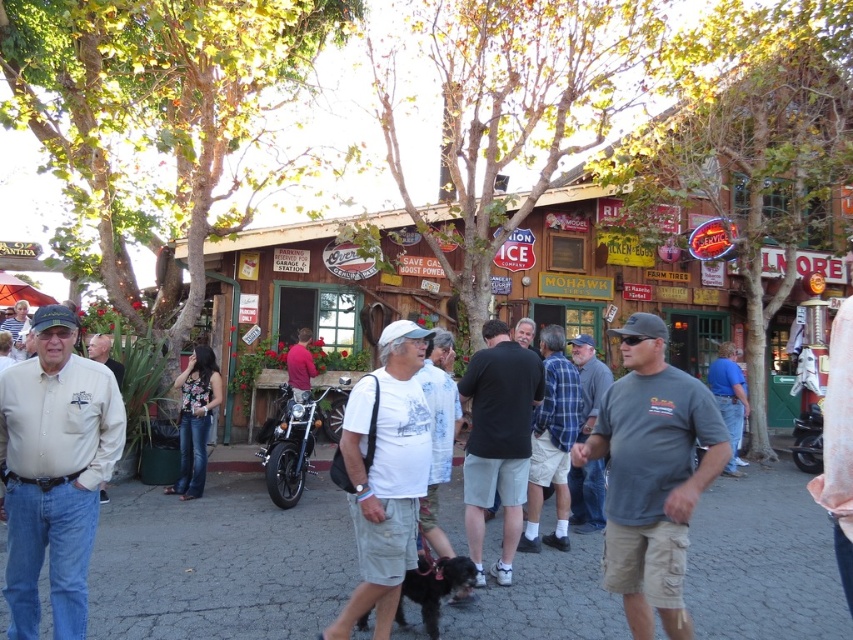
Question: Observing the image, what is the correct spatial positioning of light beige shirt at center in reference to white cotton t-shirt at center?

Choices:
 (A) above
 (B) below

Answer: (A)

Question: Estimate the real-world distances between objects in this image. Which object is closer to the light beige shirt at center?

Choices:
 (A) white cotton t-shirt at center
 (B) gray cotton t-shirt at center
 (C) gray cotton shirt at center
 (D) black cotton t-shirt at center

Answer: (A)

Question: Which of the following is the closest to the observer?

Choices:
 (A) gray cotton t-shirt at center
 (B) light beige shirt at center

Answer: (A)

Question: Does light beige shirt at center appear on the right side of white cotton t-shirt at center?

Choices:
 (A) no
 (B) yes

Answer: (A)

Question: Is light beige shirt at center further to camera compared to gray cotton t-shirt at center?

Choices:
 (A) no
 (B) yes

Answer: (B)

Question: Estimate the real-world distances between objects in this image. Which object is closer to the white cotton t-shirt at center?

Choices:
 (A) black cotton t-shirt at center
 (B) gray cotton shirt at center
 (C) gray cotton t-shirt at center

Answer: (A)